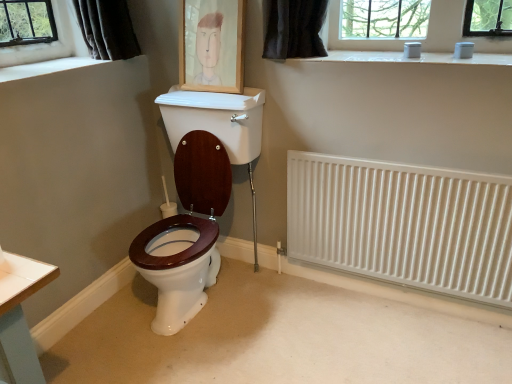
Question: Is white smooth window sill at upper left at the right side of wooden picture frame at upper center?

Choices:
 (A) no
 (B) yes

Answer: (A)

Question: Is white smooth window sill at upper left looking in the opposite direction of wooden picture frame at upper center?

Choices:
 (A) no
 (B) yes

Answer: (A)

Question: Is white smooth window sill at upper left positioned behind wooden picture frame at upper center?

Choices:
 (A) yes
 (B) no

Answer: (B)

Question: Does white smooth window sill at upper left come in front of wooden picture frame at upper center?

Choices:
 (A) yes
 (B) no

Answer: (A)

Question: From the image's perspective, does white smooth window sill at upper left appear higher than wooden picture frame at upper center?

Choices:
 (A) yes
 (B) no

Answer: (B)

Question: Considering the positions of point (51, 61) and point (373, 170), is point (51, 61) closer or farther from the camera than point (373, 170)?

Choices:
 (A) farther
 (B) closer

Answer: (A)

Question: Relative to white metallic radiator at right, is white smooth window sill at upper left in front or behind?

Choices:
 (A) front
 (B) behind

Answer: (B)

Question: From a real-world perspective, is white smooth window sill at upper left physically located above or below white metallic radiator at right?

Choices:
 (A) below
 (B) above

Answer: (B)

Question: Is white smooth window sill at upper left wider or thinner than white metallic radiator at right?

Choices:
 (A) wide
 (B) thin

Answer: (A)

Question: From the image's perspective, is wooden picture frame at upper center located above or below white smooth window sill at upper left?

Choices:
 (A) below
 (B) above

Answer: (B)

Question: In terms of width, does wooden picture frame at upper center look wider or thinner when compared to white smooth window sill at upper left?

Choices:
 (A) thin
 (B) wide

Answer: (A)

Question: Relative to white smooth window sill at upper left, is wooden picture frame at upper center in front or behind?

Choices:
 (A) behind
 (B) front

Answer: (A)

Question: From a real-world perspective, relative to white smooth window sill at upper left, is wooden picture frame at upper center vertically above or below?

Choices:
 (A) above
 (B) below

Answer: (A)

Question: In terms of width, does white metallic radiator at right look wider or thinner when compared to wooden picture frame at upper center?

Choices:
 (A) wide
 (B) thin

Answer: (B)

Question: Considering the positions of white metallic radiator at right and wooden picture frame at upper center in the image, is white metallic radiator at right taller or shorter than wooden picture frame at upper center?

Choices:
 (A) short
 (B) tall

Answer: (B)